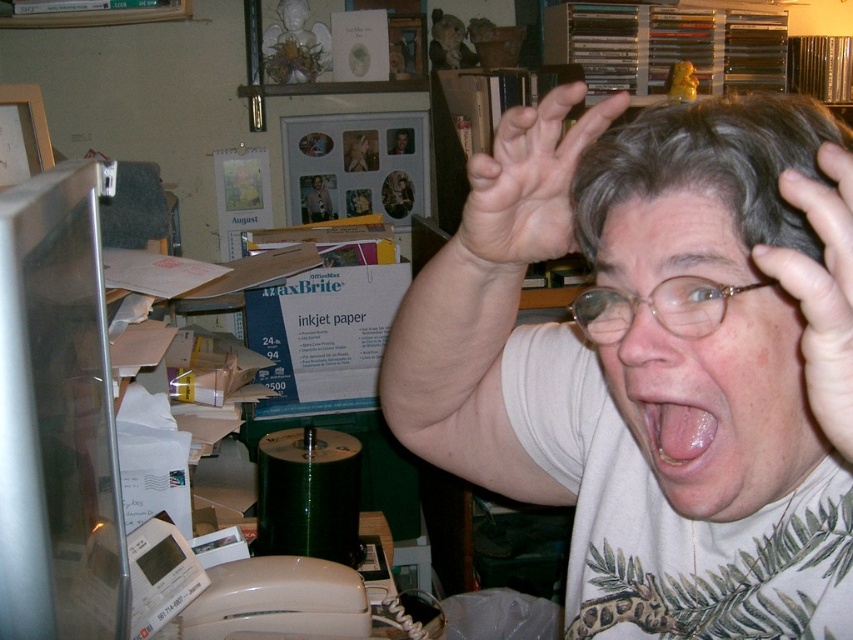
Is gray matte hand at upper center behind gold-framed glasses at center?

That is True.

Does point (520, 124) come farther from viewer compared to point (703, 332)?

Yes.

Is point (548, 148) farther from camera compared to point (592, 307)?

No, it is not.

Identify the location of gray matte hand at upper center. This screenshot has width=853, height=640. (527, 182).

Is point (457, 301) positioned behind point (86, 276)?

No.

Is white matte shirt at center bigger than metallic silver monitor at left?

Yes.

Does point (608, 512) come farther from viewer compared to point (77, 324)?

That is False.

Image resolution: width=853 pixels, height=640 pixels. What are the coordinates of `white matte shirt at center` in the screenshot? It's located at (654, 356).

Which of these two, metallic silver monitor at left or gold-framed glasses at center, stands shorter?

gold-framed glasses at center is shorter.

Find the location of a particular element. metallic silver monitor at left is located at coordinates (x=57, y=417).